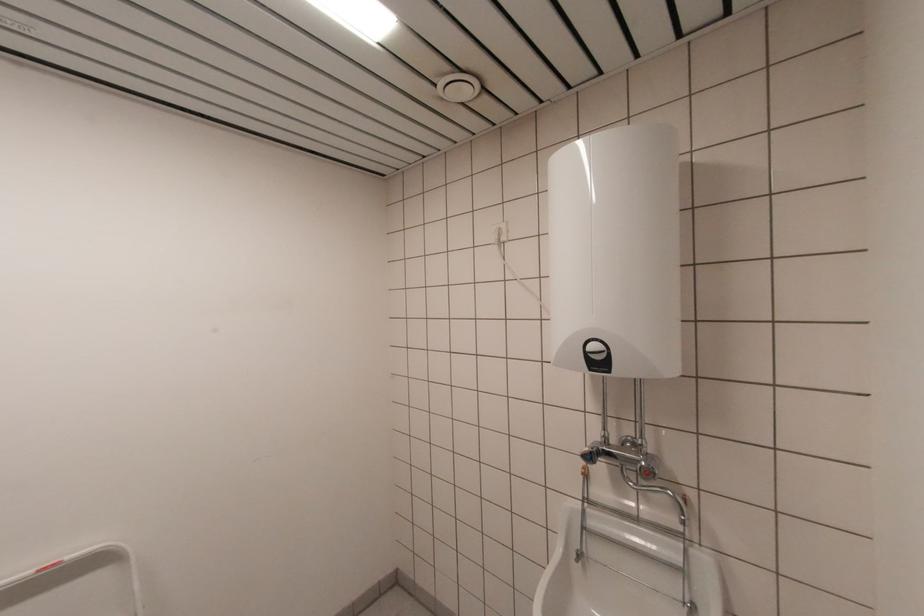
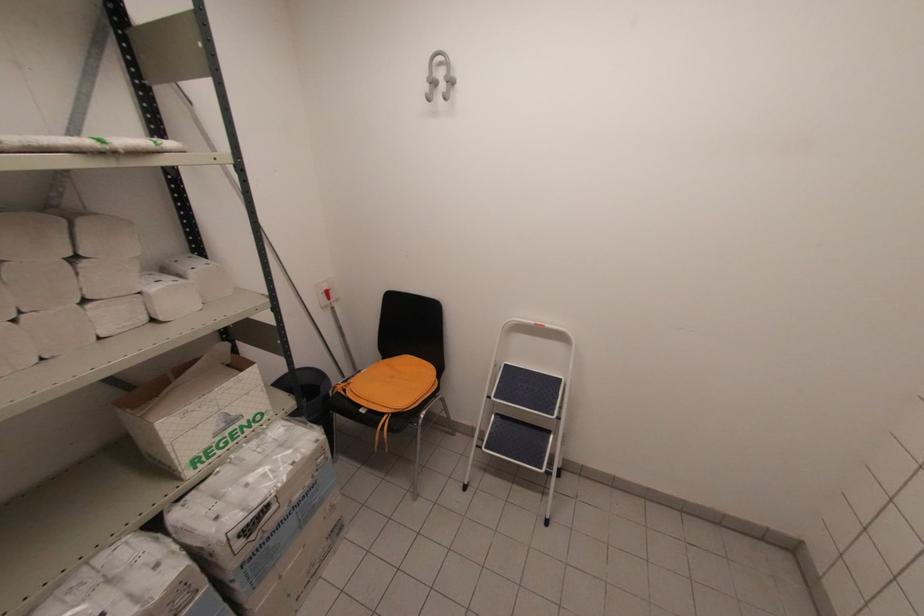
The first image is from the beginning of the video and the second image is from the end. How did the camera likely rotate when shooting the video?

The camera's rotation is toward left-down.